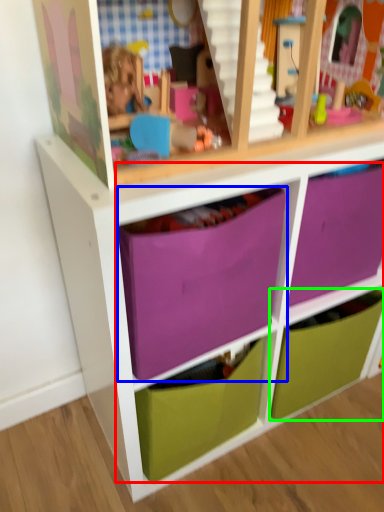
Question: Considering the real-world distances, which object is farthest from drawer (highlighted by a red box)? drawer (highlighted by a blue box) or drawer (highlighted by a green box)?

Choices:
 (A) drawer
 (B) drawer

Answer: (B)